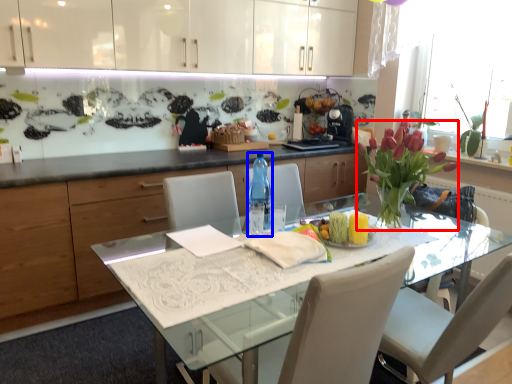
Question: Which object is further to the camera taking this photo, flower (highlighted by a red box) or bottle (highlighted by a blue box)?

Choices:
 (A) flower
 (B) bottle

Answer: (B)